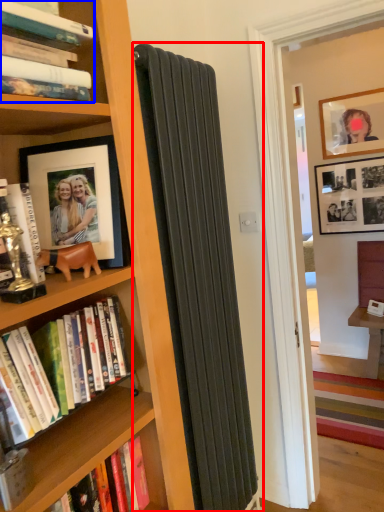
Question: Which object appears farthest to the camera in this image, curtain (highlighted by a red box) or book (highlighted by a blue box)?

Choices:
 (A) curtain
 (B) book

Answer: (A)